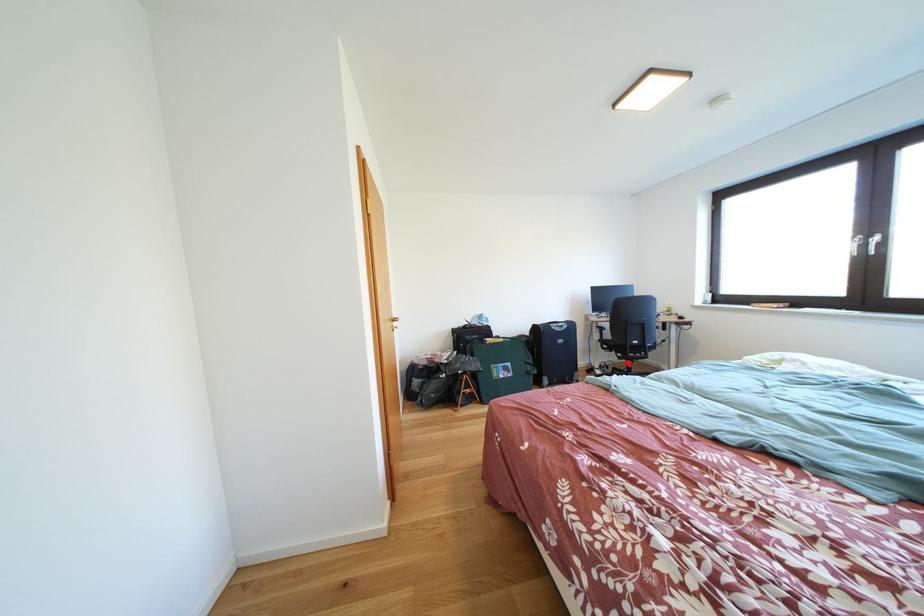
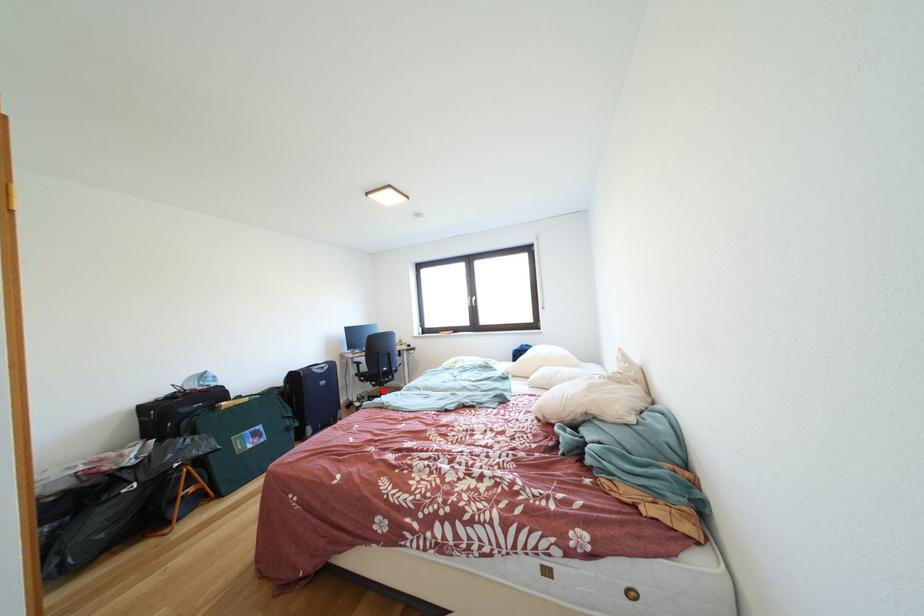
I am providing you with two images of the same scene from different viewpoints. A red point is marked on the first image and another point is marked on the second image. Does the point marked in image1 correspond to the same location as the one in image2?

Yes